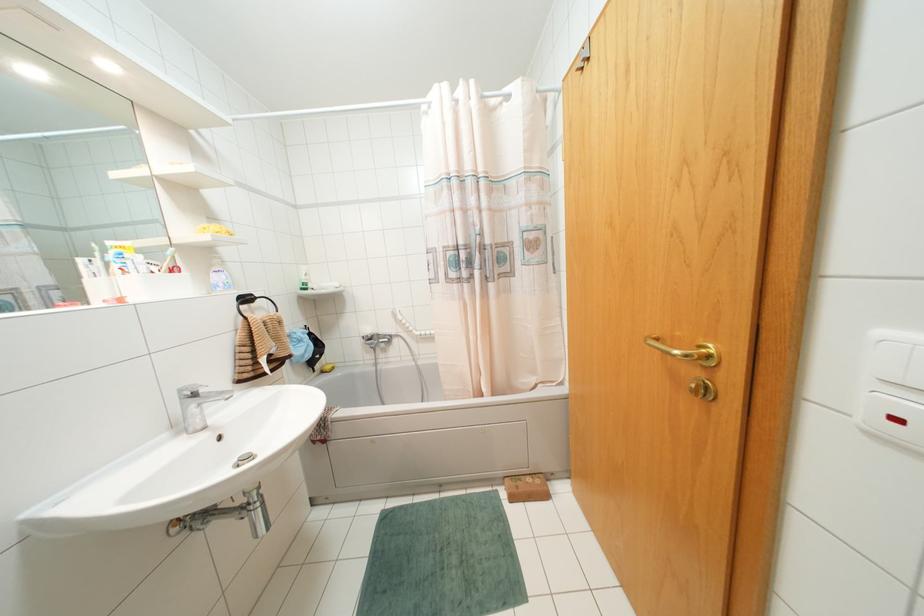
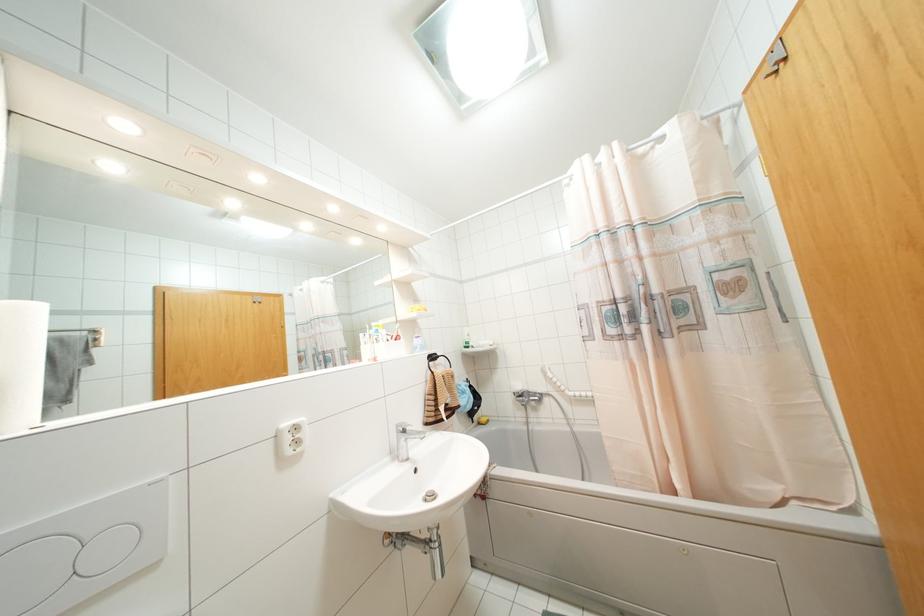
Locate, in the second image, the point that corresponds to the point at 305,274 in the first image.

(468, 334)